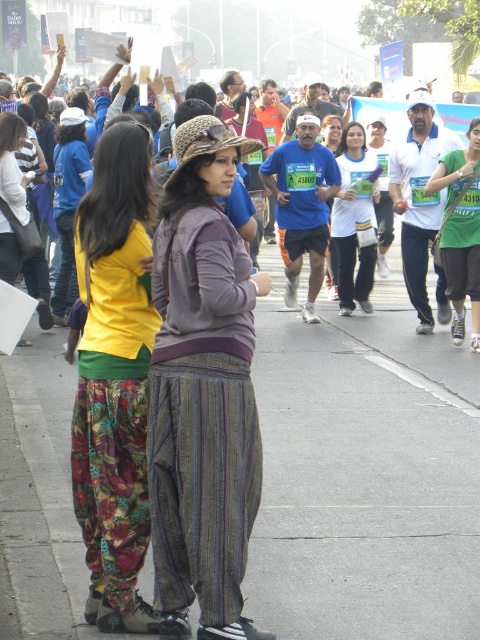
Question: Which point appears farthest from the camera in this image?

Choices:
 (A) (276, 216)
 (B) (106, 566)

Answer: (A)

Question: Which point is farther to the camera?

Choices:
 (A) matte blue shirt at left
 (B) white cotton shirt at center

Answer: (B)

Question: Can you confirm if striped fabric pants at center is bigger than blue fabric shirt at center?

Choices:
 (A) no
 (B) yes

Answer: (A)

Question: Is green fabric shirt at center to the left of white matte shirt at center from the viewer's perspective?

Choices:
 (A) no
 (B) yes

Answer: (A)

Question: Is striped fabric pants at center smaller than green fabric shirt at center?

Choices:
 (A) yes
 (B) no

Answer: (A)

Question: Among these objects, which one is nearest to the camera?

Choices:
 (A) green fabric shirt at center
 (B) white matte shirt at center
 (C) blue fabric shirt at center
 (D) floral pants at center

Answer: (D)